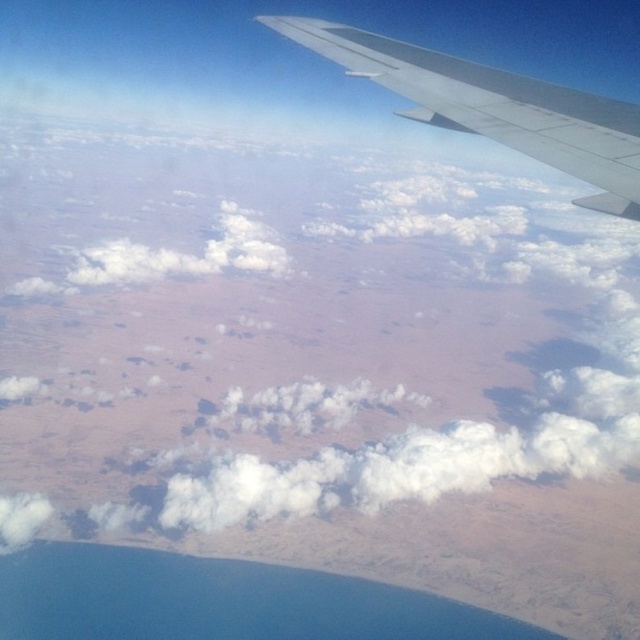
You are a pilot looking at the view from the airplane window. You notice a point marked at coordinates (292, 328). What object is located at that point?

The point at coordinates (292, 328) indicates a white fluffy cloud at upper center.

You are a pilot flying at an altitude of 2000 feet. You notice a point marked at coordinates point [276,272] in the scene below. Can you safely descend to view this point without risking collision?

The distance of point [276,272] from camera is 2042.20 feet, which is slightly higher than your current altitude of 2000 feet. Therefore, descending to view this point may risk collision as the point is 42.20 feet above your current altitude.